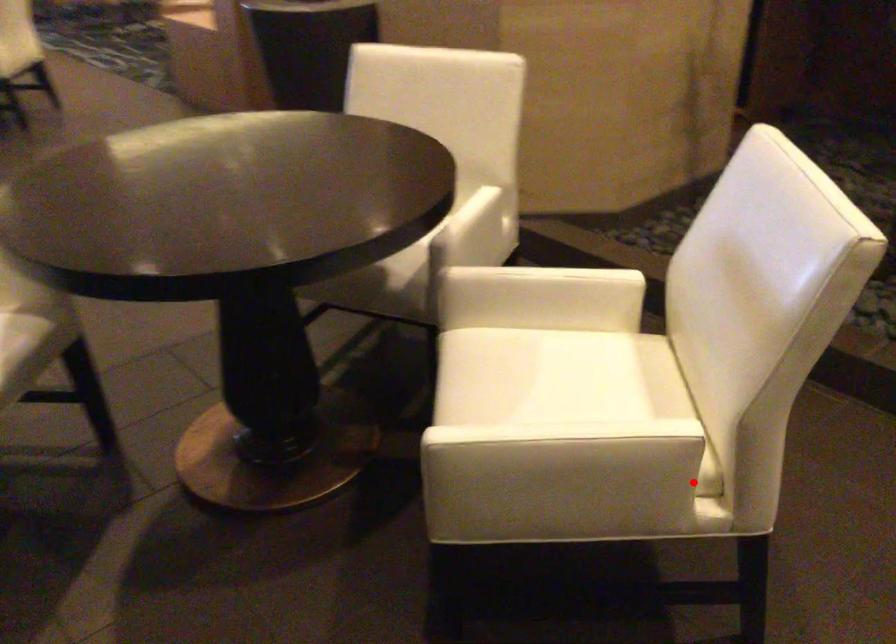
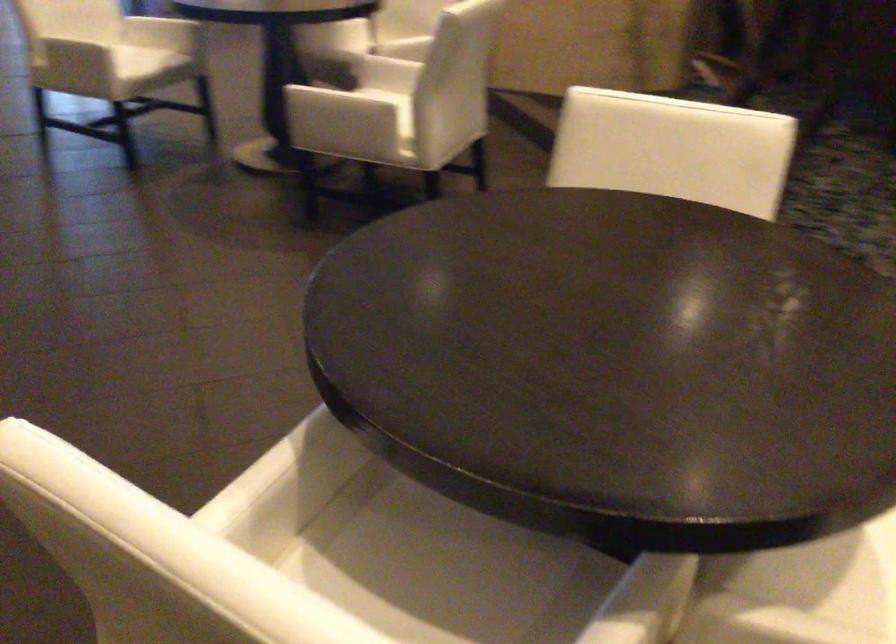
Question: I am providing you with two images of the same scene from different viewpoints. In image1, a red point is highlighted. Considering the same 3D point in image2, which of the following is correct?

Choices:
 (A) It is closer
 (B) It is farther

Answer: (B)